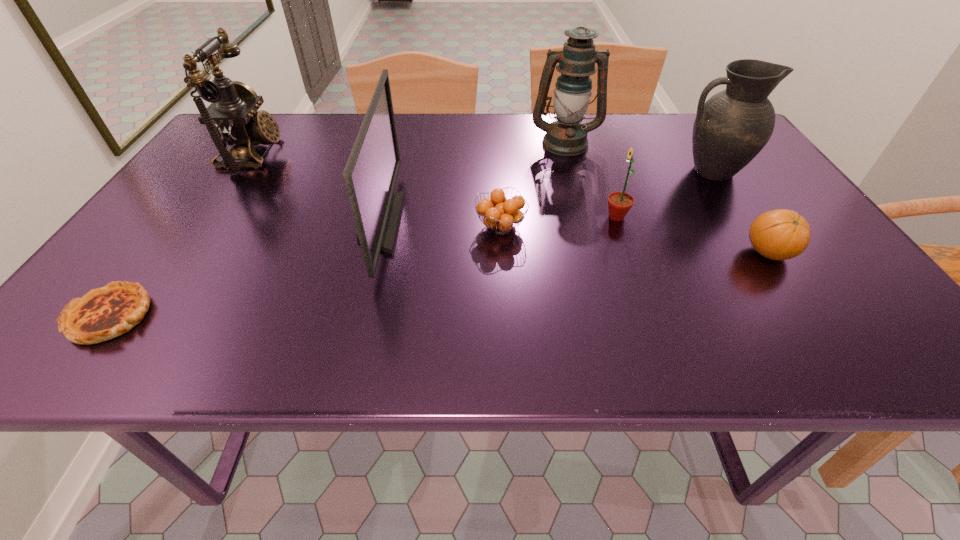
At what (x,y) coordinates should I click in order to perform the action: click on free space between the left orange fruit and the pitcher. Please return your answer as a coordinate pair (x, y). This screenshot has width=960, height=540. Looking at the image, I should click on click(606, 199).

Locate an element on the screen. Image resolution: width=960 pixels, height=540 pixels. vacant space that is in between the monitor and the oil lamp is located at coordinates (472, 183).

I want to click on empty location between the shorter orange fruit and the fifth tallest object, so click(x=559, y=222).

At what (x,y) coordinates should I click in order to perform the action: click on free point between the right orange fruit and the fourth object from left to right. Please return your answer as a coordinate pair (x, y). This screenshot has height=540, width=960. Looking at the image, I should click on (635, 240).

The width and height of the screenshot is (960, 540). Find the location of `the third closest object to the sixth tallest object`. the third closest object to the sixth tallest object is located at coordinates (576, 62).

You are a GUI agent. You are given a task and a screenshot of the screen. Output one action in this format:
    pyautogui.click(x=<x>, y=<y>)
    Task: Click on the object that stands as the second closest to the oil lamp
    This screenshot has width=960, height=540.
    Given the screenshot: What is the action you would take?
    pyautogui.click(x=619, y=203)

The image size is (960, 540). Identify the location of free space that satisfies the following two spatial constraints: 1. on the side of the pitcher with the handle; 2. on the front side of the seventh tallest object. (747, 227).

At what (x,y) coordinates should I click in order to perform the action: click on free location that satisfies the following two spatial constraints: 1. on the front side of the oil lamp; 2. on the right side of the third shortest object. Please return your answer as a coordinate pair (x, y). Looking at the image, I should click on (593, 253).

The height and width of the screenshot is (540, 960). Identify the location of free region that satisfies the following two spatial constraints: 1. on the rotary dial of the telephone; 2. on the left side of the sixth tallest object. (186, 253).

Identify the location of vacant space that satisfies the following two spatial constraints: 1. on the screen side of the monitor; 2. on the back side of the taller orange fruit. Image resolution: width=960 pixels, height=540 pixels. (373, 253).